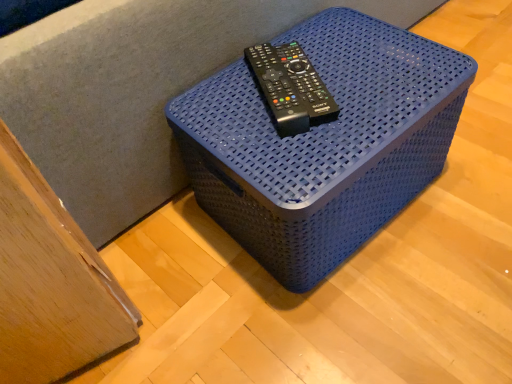
Image resolution: width=512 pixels, height=384 pixels. Identify the location of free space in front of black plastic remote control at center. (288, 146).